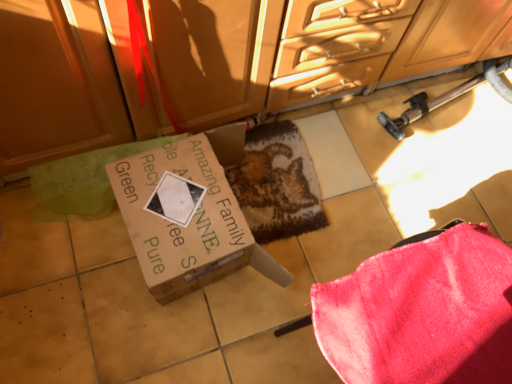
Question: Should I look upward or downward to see velvety pink blanket at lower right?

Choices:
 (A) up
 (B) down

Answer: (B)

Question: Is textured brown mat at center further to camera compared to velvety pink blanket at lower right?

Choices:
 (A) no
 (B) yes

Answer: (B)

Question: Is textured brown mat at center smaller than velvety pink blanket at lower right?

Choices:
 (A) yes
 (B) no

Answer: (A)

Question: Considering the relative positions of textured brown mat at center and velvety pink blanket at lower right in the image provided, is textured brown mat at center to the right of velvety pink blanket at lower right from the viewer's perspective?

Choices:
 (A) yes
 (B) no

Answer: (B)

Question: Can velvety pink blanket at lower right be found inside textured brown mat at center?

Choices:
 (A) yes
 (B) no

Answer: (B)

Question: Does textured brown mat at center have a greater width compared to velvety pink blanket at lower right?

Choices:
 (A) yes
 (B) no

Answer: (B)

Question: Is textured brown mat at center located outside velvety pink blanket at lower right?

Choices:
 (A) no
 (B) yes

Answer: (B)

Question: Can you confirm if brown cardboard box at center is shorter than textured brown mat at center?

Choices:
 (A) yes
 (B) no

Answer: (B)

Question: Is textured brown mat at center at the back of brown cardboard box at center?

Choices:
 (A) yes
 (B) no

Answer: (B)

Question: Is the surface of brown cardboard box at center in direct contact with textured brown mat at center?

Choices:
 (A) no
 (B) yes

Answer: (A)

Question: From a real-world perspective, is brown cardboard box at center positioned under textured brown mat at center based on gravity?

Choices:
 (A) no
 (B) yes

Answer: (A)

Question: Can you confirm if brown cardboard box at center is thinner than textured brown mat at center?

Choices:
 (A) no
 (B) yes

Answer: (B)

Question: From the image's perspective, is brown cardboard box at center above textured brown mat at center?

Choices:
 (A) yes
 (B) no

Answer: (B)

Question: Considering the relative sizes of velvety pink blanket at lower right and textured brown mat at center in the image provided, is velvety pink blanket at lower right wider than textured brown mat at center?

Choices:
 (A) no
 (B) yes

Answer: (B)